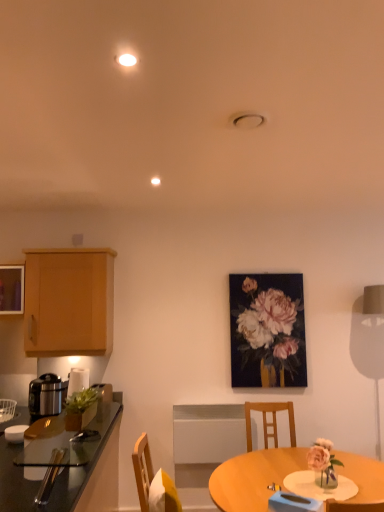
Question: Can shiny black countertop at left be found inside metallic silver rice cooker at left?

Choices:
 (A) yes
 (B) no

Answer: (B)

Question: Is metallic silver rice cooker at left positioned in front of shiny black countertop at left?

Choices:
 (A) no
 (B) yes

Answer: (A)

Question: Does metallic silver rice cooker at left lie behind shiny black countertop at left?

Choices:
 (A) no
 (B) yes

Answer: (B)

Question: From the image's perspective, would you say metallic silver rice cooker at left is positioned over shiny black countertop at left?

Choices:
 (A) yes
 (B) no

Answer: (A)

Question: From the image's perspective, is metallic silver rice cooker at left beneath shiny black countertop at left?

Choices:
 (A) yes
 (B) no

Answer: (B)

Question: Does metallic silver rice cooker at left have a lesser height compared to shiny black countertop at left?

Choices:
 (A) yes
 (B) no

Answer: (A)

Question: Does metallic gold picture frame at center lie behind metallic silver rice cooker at left?

Choices:
 (A) yes
 (B) no

Answer: (A)

Question: Is metallic gold picture frame at center next to metallic silver rice cooker at left and touching it?

Choices:
 (A) no
 (B) yes

Answer: (A)

Question: Is metallic gold picture frame at center at the right side of metallic silver rice cooker at left?

Choices:
 (A) no
 (B) yes

Answer: (B)

Question: Is metallic gold picture frame at center turned away from metallic silver rice cooker at left?

Choices:
 (A) no
 (B) yes

Answer: (A)

Question: Can you confirm if metallic gold picture frame at center is taller than metallic silver rice cooker at left?

Choices:
 (A) yes
 (B) no

Answer: (A)

Question: From a real-world perspective, is metallic gold picture frame at center beneath metallic silver rice cooker at left?

Choices:
 (A) no
 (B) yes

Answer: (A)

Question: Is matte black table lamp at right looking in the opposite direction of light brown wood cabinet at left?

Choices:
 (A) no
 (B) yes

Answer: (A)